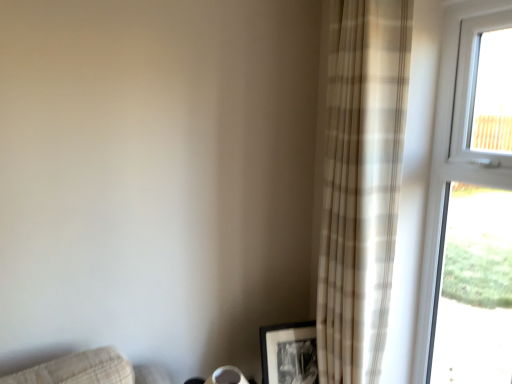
Question: Does point (456, 46) appear closer or farther from the camera than point (315, 357)?

Choices:
 (A) closer
 (B) farther

Answer: (A)

Question: From a real-world perspective, is white plastic window at upper right positioned above or below black matte picture frame at lower right?

Choices:
 (A) above
 (B) below

Answer: (A)

Question: Estimate the real-world distances between objects in this image. Which object is farther from the black matte picture frame at lower right?

Choices:
 (A) beige plaid curtain at right
 (B) white plastic window at upper right

Answer: (B)

Question: Estimate the real-world distances between objects in this image. Which object is farther from the beige plaid curtain at right?

Choices:
 (A) black matte picture frame at lower right
 (B) white plastic window at upper right

Answer: (A)